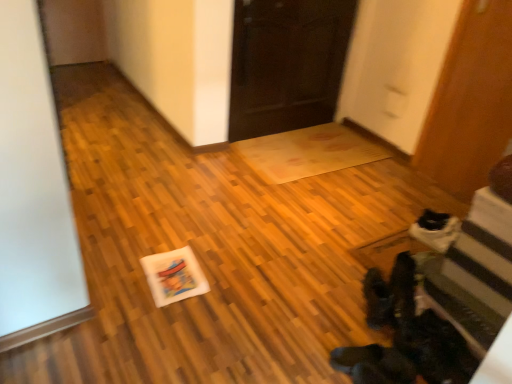
In order to click on vacant area that lies between dark wood door at center, which appears as the 1th door when viewed from the left, and wooden door at right, which appears as the 1th door when viewed from the right in this screenshot , I will do [346, 161].